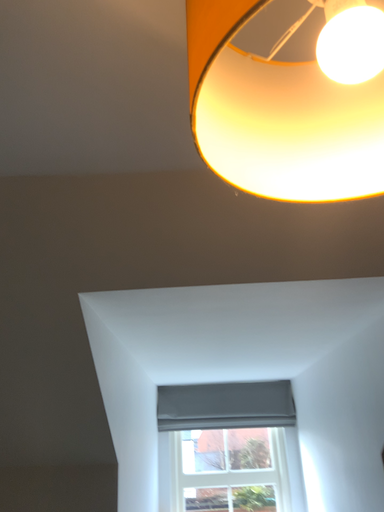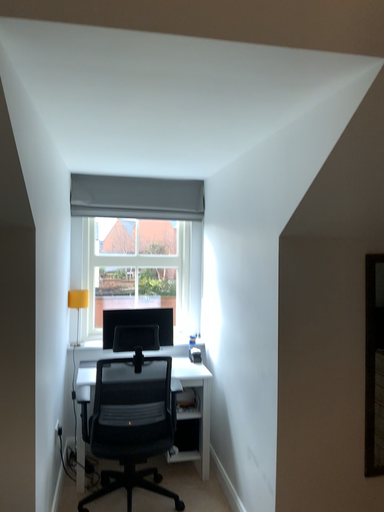
Question: How did the camera likely rotate when shooting the video?

Choices:
 (A) rotated upward
 (B) rotated downward

Answer: (B)